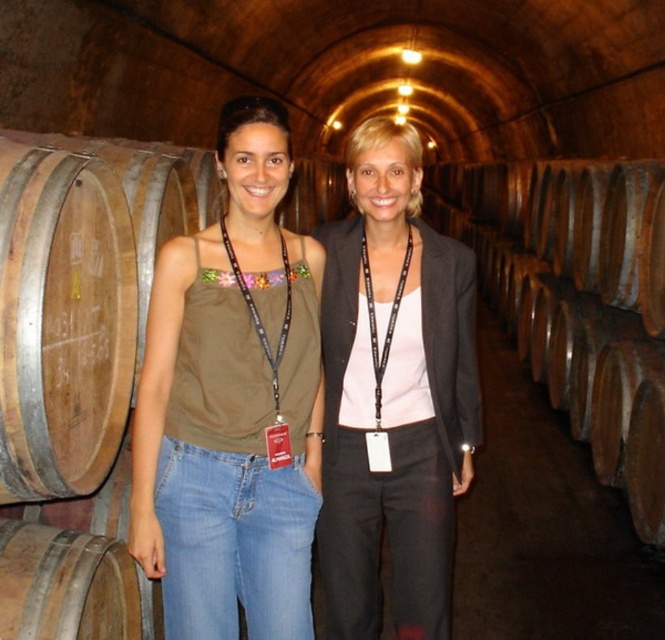
Looking at this image, is matte brown tank top at center to the right of matte black blazer at center from the viewer's perspective?

No, matte brown tank top at center is not to the right of matte black blazer at center.

Between matte brown tank top at center and matte black blazer at center, which one has less height?

matte brown tank top at center is shorter.

Locate an element on the screen. This screenshot has height=640, width=665. matte brown tank top at center is located at coordinates (231, 403).